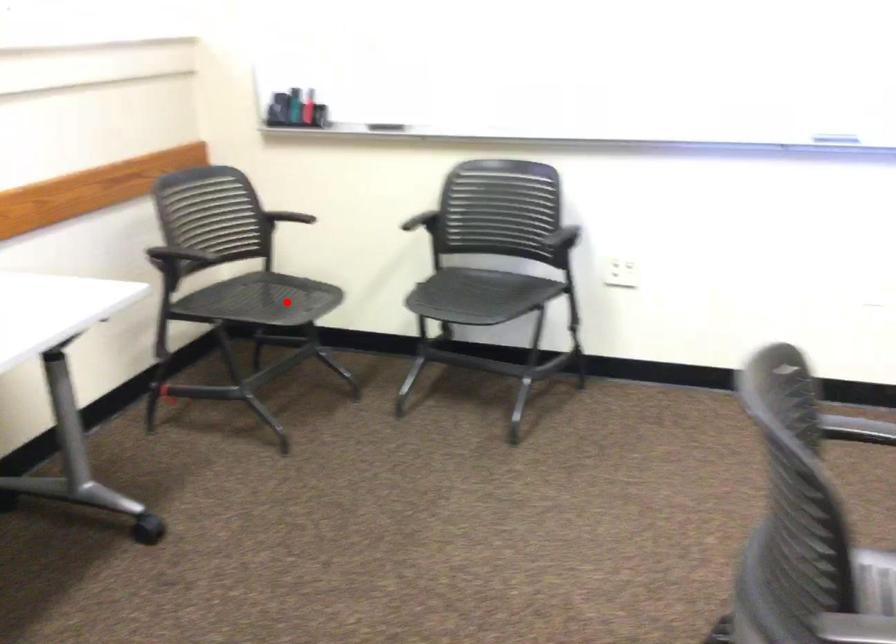
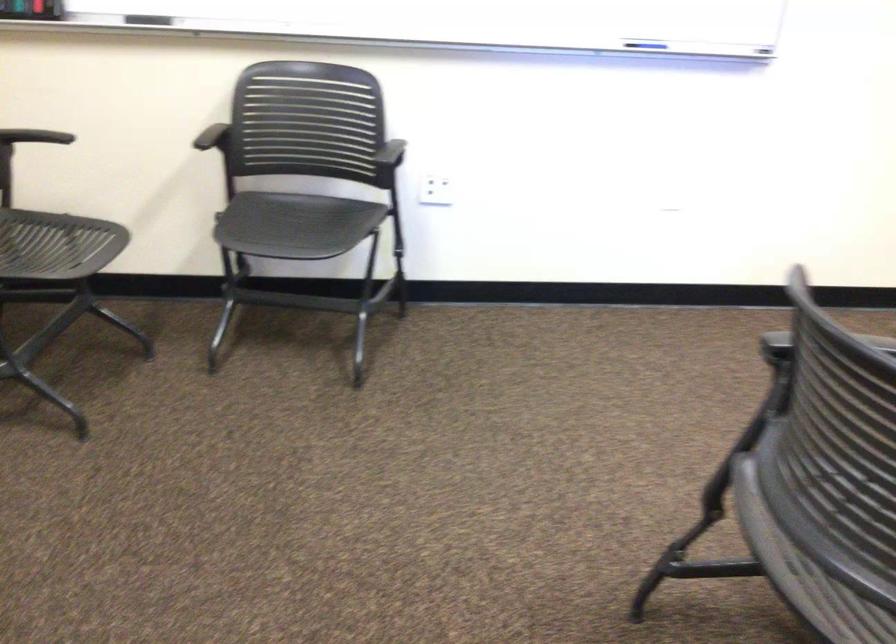
Question: I am providing you with two images of the same scene from different viewpoints. A red point is marked on the first image. At the location where the point appears in image 1, is it still visible in image 2?

Choices:
 (A) Yes
 (B) No

Answer: (A)